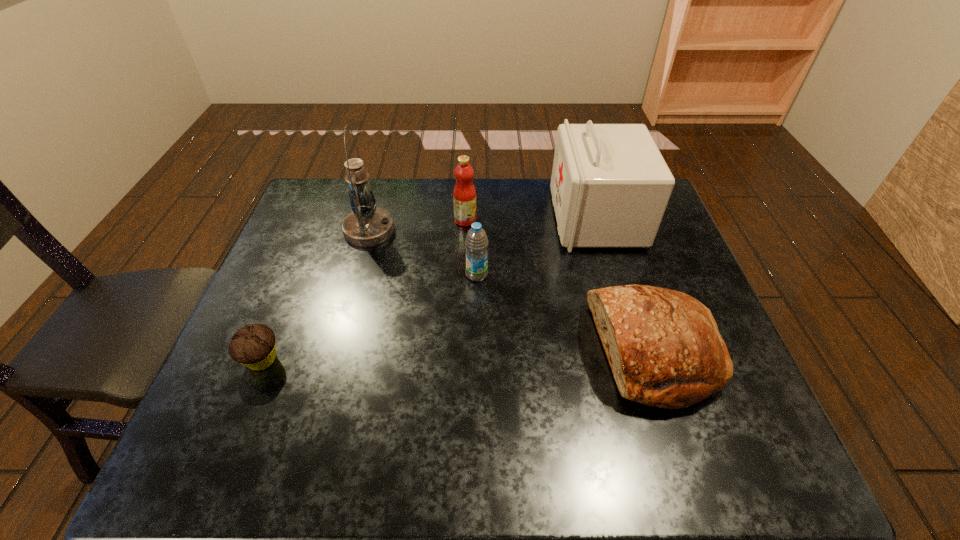
Locate an element on the screen. This screenshot has height=540, width=960. blank area in the image that satisfies the following two spatial constraints: 1. on the back side of the shortest object; 2. on the right side of the fifth object from right to left is located at coordinates (315, 230).